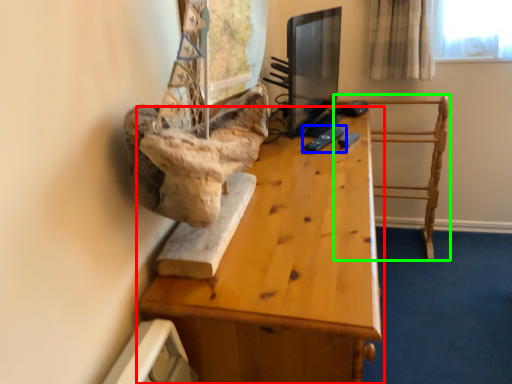
Question: Estimate the real-world distances between objects in this image. Which object is farther from table (highlighted by a red box), remote (highlighted by a blue box) or furniture (highlighted by a green box)?

Choices:
 (A) remote
 (B) furniture

Answer: (B)